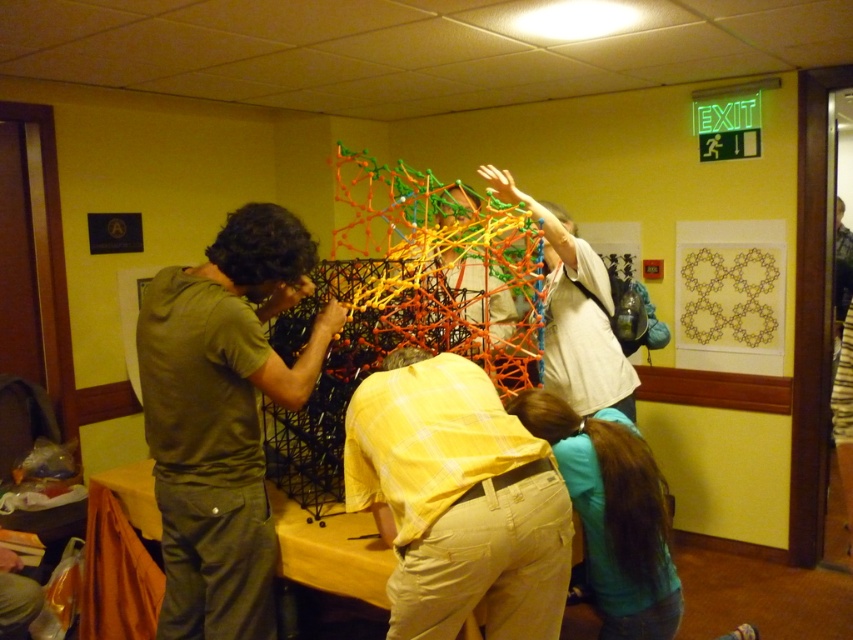
Question: Is khaki pants at center thinner than light beige fabric shirt at center?

Choices:
 (A) yes
 (B) no

Answer: (A)

Question: Can you confirm if light beige fabric shirt at center is bigger than yellow matte table at center?

Choices:
 (A) yes
 (B) no

Answer: (A)

Question: Estimate the real-world distances between objects in this image. Which object is farther from the khaki pants at center?

Choices:
 (A) light beige fabric shirt at center
 (B) matte green shirt at left

Answer: (A)

Question: Can you confirm if matte green shirt at left is positioned to the right of yellow matte table at center?

Choices:
 (A) no
 (B) yes

Answer: (A)

Question: Considering the real-world distances, which object is closest to the matte green shirt at left?

Choices:
 (A) yellow matte table at center
 (B) light beige fabric shirt at center
 (C) khaki pants at center

Answer: (A)

Question: Estimate the real-world distances between objects in this image. Which object is farther from the matte green shirt at left?

Choices:
 (A) yellow matte table at center
 (B) khaki pants at center
 (C) light beige fabric shirt at center

Answer: (C)